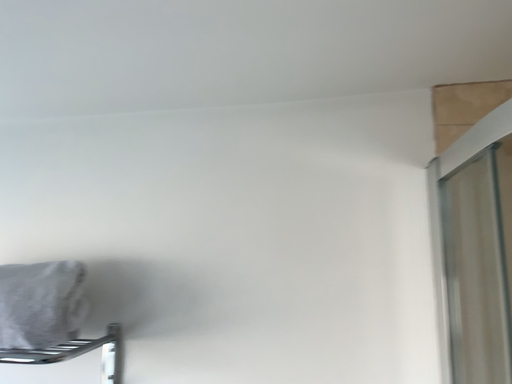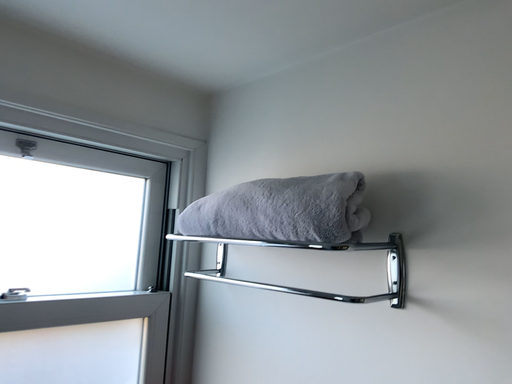
Question: Which way did the camera rotate in the video?

Choices:
 (A) rotated left
 (B) rotated right

Answer: (A)